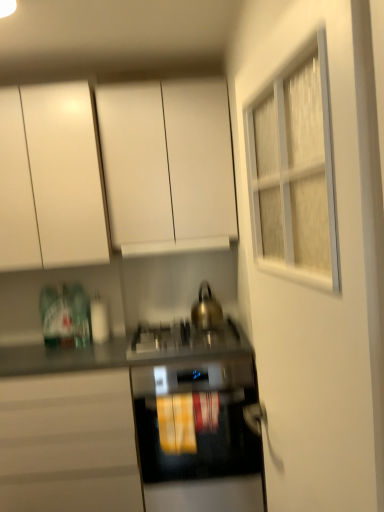
Question: Which direction should I rotate to face white matte cabinet at upper center, which ranks as the 1th cabinetry in top-to-bottom order, — up or down?

Choices:
 (A) up
 (B) down

Answer: (A)

Question: Is white matte cabinet at upper left, the 2th cabinetry in the top-to-bottom sequence, further to the viewer compared to matte white cabinet at lower left, which appears as the first cabinetry when ordered from the bottom?

Choices:
 (A) no
 (B) yes

Answer: (B)

Question: Are white matte cabinet at upper left, the 2th cabinetry in the top-to-bottom sequence, and matte white cabinet at lower left, the third cabinetry positioned from the top, far apart?

Choices:
 (A) no
 (B) yes

Answer: (A)

Question: Does white matte cabinet at upper left, arranged as the second cabinetry when ordered from the bottom, have a greater width compared to matte white cabinet at lower left, which appears as the first cabinetry when ordered from the bottom?

Choices:
 (A) yes
 (B) no

Answer: (B)

Question: Is white matte cabinet at upper left, the 2th cabinetry in the top-to-bottom sequence, touching matte white cabinet at lower left, which appears as the first cabinetry when ordered from the bottom?

Choices:
 (A) no
 (B) yes

Answer: (A)

Question: Is white matte cabinet at upper left, the 2th cabinetry in the top-to-bottom sequence, positioned before matte white cabinet at lower left, which appears as the first cabinetry when ordered from the bottom?

Choices:
 (A) yes
 (B) no

Answer: (B)

Question: Is white matte cabinet at upper left, arranged as the second cabinetry when ordered from the bottom, shorter than matte white cabinet at lower left, the third cabinetry positioned from the top?

Choices:
 (A) no
 (B) yes

Answer: (B)

Question: Is matte white cabinet at lower left, which appears as the first cabinetry when ordered from the bottom, aimed at black glass oven at center?

Choices:
 (A) no
 (B) yes

Answer: (B)

Question: Is matte white cabinet at lower left, the third cabinetry positioned from the top, not within black glass oven at center?

Choices:
 (A) no
 (B) yes

Answer: (B)

Question: Is matte white cabinet at lower left, the third cabinetry positioned from the top, positioned with its back to black glass oven at center?

Choices:
 (A) no
 (B) yes

Answer: (A)

Question: Considering the relative sizes of matte white cabinet at lower left, the third cabinetry positioned from the top, and black glass oven at center in the image provided, is matte white cabinet at lower left, the third cabinetry positioned from the top, smaller than black glass oven at center?

Choices:
 (A) yes
 (B) no

Answer: (B)

Question: Is matte white cabinet at lower left, the third cabinetry positioned from the top, taller than black glass oven at center?

Choices:
 (A) no
 (B) yes

Answer: (B)

Question: Does matte white cabinet at lower left, the third cabinetry positioned from the top, have a greater width compared to black glass oven at center?

Choices:
 (A) no
 (B) yes

Answer: (B)

Question: Does metallic silver gas stove at center come in front of white matte cabinet at upper center, which ranks as the 1th cabinetry in top-to-bottom order?

Choices:
 (A) no
 (B) yes

Answer: (B)